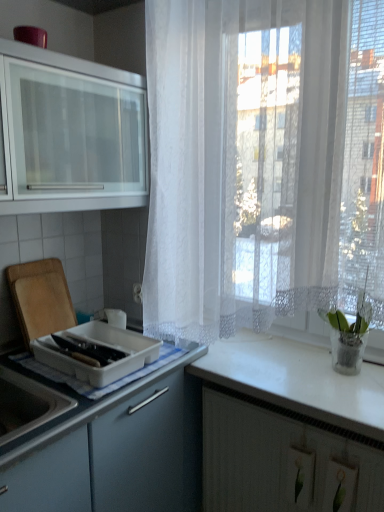
Image resolution: width=384 pixels, height=512 pixels. What are the coordinates of `free space below white lace curtain at right (from a real-world perspective)` in the screenshot? It's located at (264, 380).